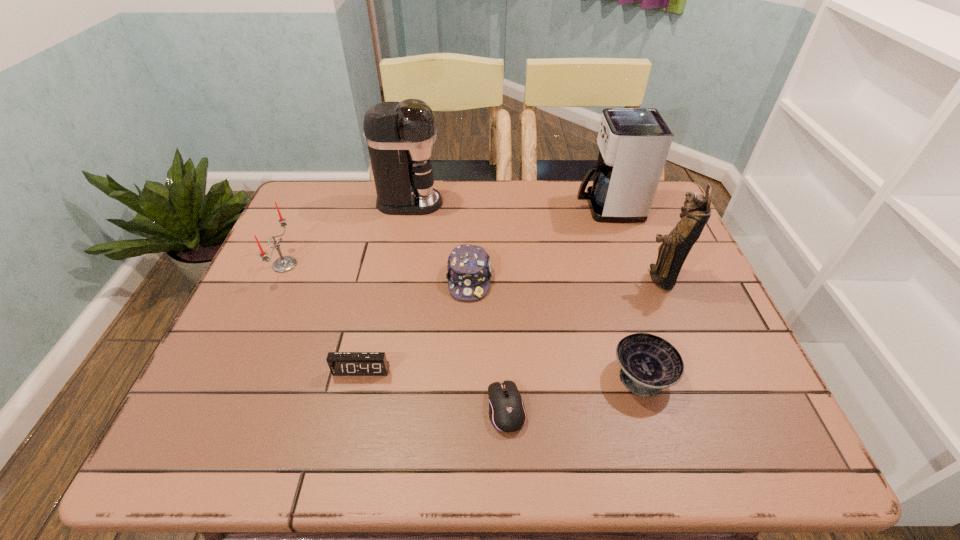
The image size is (960, 540). I want to click on the left coffee maker, so click(x=400, y=136).

Identify the location of the right coffee maker. Image resolution: width=960 pixels, height=540 pixels. (634, 143).

In order to click on figurine in this screenshot , I will do `click(672, 253)`.

This screenshot has width=960, height=540. What are the coordinates of `candle` in the screenshot? It's located at (285, 263).

I want to click on the leftmost object, so click(285, 263).

Identify the location of headwear. The height and width of the screenshot is (540, 960). (469, 268).

At what (x,y) coordinates should I click in order to perform the action: click on bowl. Please return your answer as a coordinate pair (x, y). This screenshot has height=540, width=960. Looking at the image, I should click on (649, 363).

At what (x,y) coordinates should I click in order to perform the action: click on alarm clock. Please return your answer as a coordinate pair (x, y). The image size is (960, 540). Looking at the image, I should click on (340, 363).

Find the location of `the shortest object`. the shortest object is located at coordinates (507, 413).

You are a GUI agent. You are given a task and a screenshot of the screen. Output one action in this format:
    pyautogui.click(x=<x>, y=<y>)
    Task: Click on the free space located 0.060m place cup under the spout of the left coffee maker
    This screenshot has height=540, width=960.
    Given the screenshot: What is the action you would take?
    pyautogui.click(x=462, y=203)